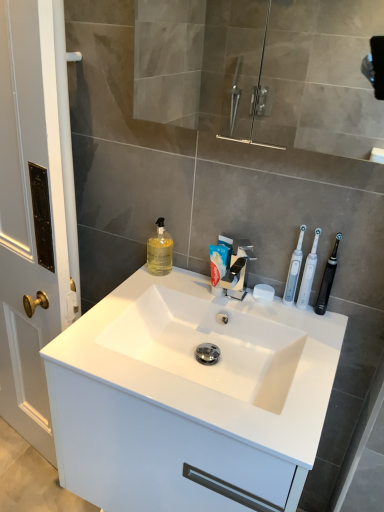
Question: Is transparent glass mirror at upper center thinner than white matte soap at center?

Choices:
 (A) yes
 (B) no

Answer: (B)

Question: Is transparent glass mirror at upper center positioned with its back to white matte soap at center?

Choices:
 (A) no
 (B) yes

Answer: (A)

Question: Is transparent glass mirror at upper center positioned in front of white matte soap at center?

Choices:
 (A) no
 (B) yes

Answer: (B)

Question: Can you confirm if transparent glass mirror at upper center is bigger than white matte soap at center?

Choices:
 (A) no
 (B) yes

Answer: (B)

Question: Is transparent glass mirror at upper center further to the viewer compared to white matte soap at center?

Choices:
 (A) no
 (B) yes

Answer: (A)

Question: Is transparent glass mirror at upper center to the left of white matte soap at center from the viewer's perspective?

Choices:
 (A) no
 (B) yes

Answer: (B)

Question: Is white plastic toothbrushes at right, which is the third toothbrush in right-to-left order, placed right next to polished chrome faucet at center?

Choices:
 (A) no
 (B) yes

Answer: (A)

Question: Is white plastic toothbrushes at right, which is the third toothbrush in right-to-left order, not close to polished chrome faucet at center?

Choices:
 (A) yes
 (B) no

Answer: (B)

Question: From a real-world perspective, is white plastic toothbrushes at right, which is the third toothbrush in right-to-left order, beneath polished chrome faucet at center?

Choices:
 (A) no
 (B) yes

Answer: (A)

Question: Considering the relative sizes of white plastic toothbrushes at right, which is the third toothbrush in right-to-left order, and polished chrome faucet at center in the image provided, is white plastic toothbrushes at right, which is the third toothbrush in right-to-left order, taller than polished chrome faucet at center?

Choices:
 (A) yes
 (B) no

Answer: (A)

Question: Does white plastic toothbrushes at right, which is the 1th toothbrush in left-to-right order, appear on the right side of polished chrome faucet at center?

Choices:
 (A) yes
 (B) no

Answer: (A)

Question: Is white plastic toothbrushes at right, which is the 1th toothbrush in left-to-right order, closer to camera compared to polished chrome faucet at center?

Choices:
 (A) yes
 (B) no

Answer: (B)

Question: From the image's perspective, is transparent glass mirror at upper center on top of translucent yellow liquid at sink left?

Choices:
 (A) yes
 (B) no

Answer: (A)